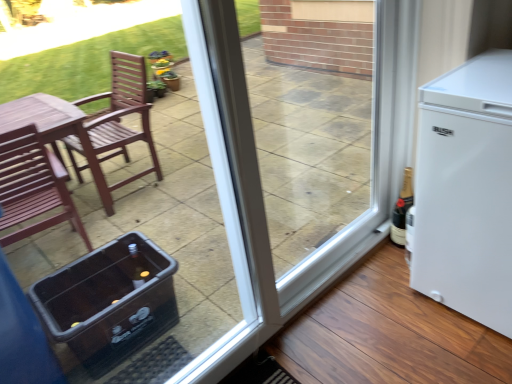
At what (x,y) coordinates should I click in order to perform the action: click on blank space above white matte refrigerator at right (from a real-world perspective). Please return your answer as a coordinate pair (x, y). Looking at the image, I should click on (489, 74).